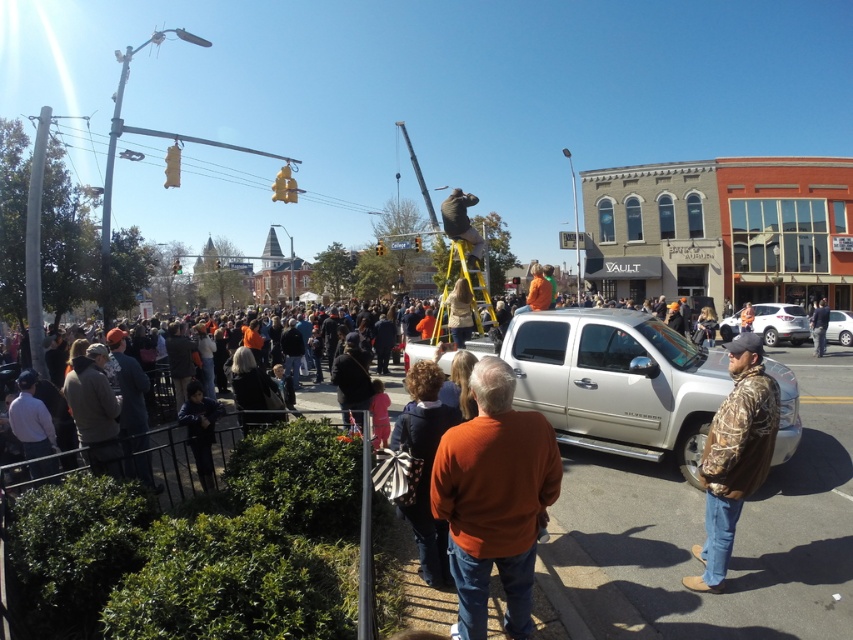
Is point (624, 372) in front of point (177, 476)?

That is False.

Can you confirm if white matte pickup truck at center is taller than orange fabric crowd at lower left?

Correct, white matte pickup truck at center is much taller as orange fabric crowd at lower left.

I want to click on white matte pickup truck at center, so click(x=616, y=381).

Consider the image. Does white matte pickup truck at center appear under camo jacket at center?

Actually, white matte pickup truck at center is above camo jacket at center.

Between white matte pickup truck at center and camo jacket at center, which one has less height?

camo jacket at center

Does point (517, 364) come behind point (751, 364)?

Yes, point (517, 364) is farther from viewer.

The width and height of the screenshot is (853, 640). In order to click on white matte pickup truck at center in this screenshot , I will do `click(616, 381)`.

Does yellow metallic ladder at center have a lesser width compared to camouflage jacket at lower right?

Indeed, yellow metallic ladder at center has a lesser width compared to camouflage jacket at lower right.

Who is positioned more to the left, yellow metallic ladder at center or camouflage jacket at lower right?

yellow metallic ladder at center is more to the left.

This screenshot has width=853, height=640. What are the coordinates of `yellow metallic ladder at center` in the screenshot? It's located at (467, 292).